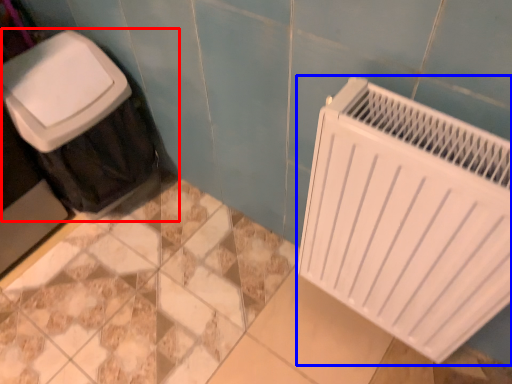
Question: Which object appears farthest to the camera in this image, waste container (highlighted by a red box) or radiator (highlighted by a blue box)?

Choices:
 (A) waste container
 (B) radiator

Answer: (A)